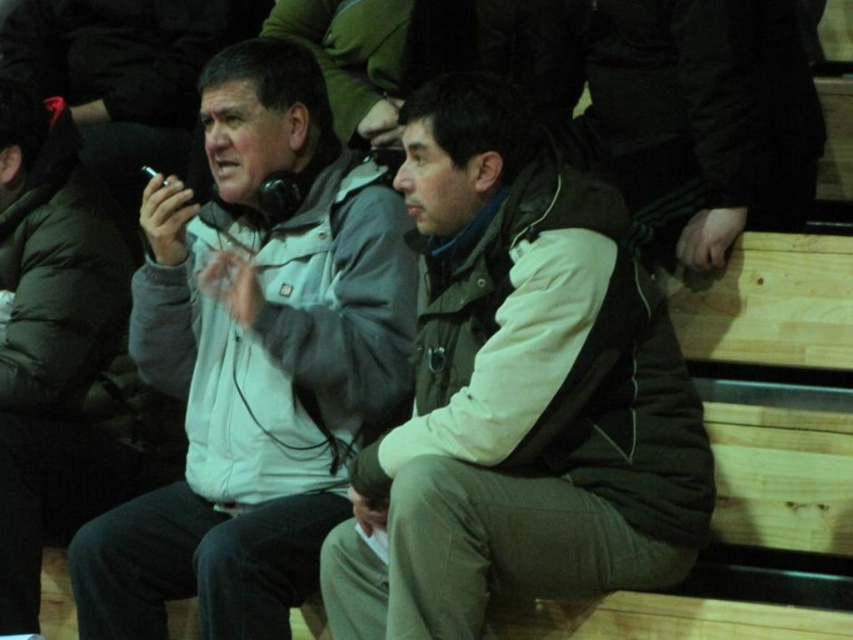
Question: Can you confirm if gray matte jacket at center is positioned below matte gray jacket at left?

Choices:
 (A) no
 (B) yes

Answer: (A)

Question: Which of these objects is positioned closest to the gray matte jacket at center?

Choices:
 (A) matte brown jacket at center
 (B) matte gray jacket at left

Answer: (A)

Question: Which object is positioned closest to the gray matte jacket at center?

Choices:
 (A) matte gray jacket at left
 (B) matte brown jacket at center

Answer: (B)

Question: In this image, where is matte brown jacket at center located relative to matte gray jacket at left?

Choices:
 (A) above
 (B) below

Answer: (B)

Question: Which point is farther from the camera taking this photo?

Choices:
 (A) (608, 506)
 (B) (245, 417)

Answer: (B)

Question: Does gray matte jacket at center come behind matte gray jacket at left?

Choices:
 (A) no
 (B) yes

Answer: (A)